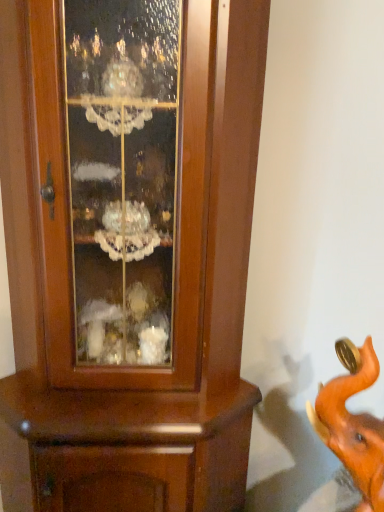
What do you see at coordinates (174, 290) in the screenshot?
I see `brown wooden cupboard at center` at bounding box center [174, 290].

Locate an element on the screen. This screenshot has width=384, height=512. brown wooden cupboard at center is located at coordinates (174, 290).

What is the approximate height of orange matte elephant at lower right?

13.83 inches.

What do you see at coordinates (353, 423) in the screenshot? This screenshot has width=384, height=512. I see `orange matte elephant at lower right` at bounding box center [353, 423].

Find the location of `orange matte elephant at lower right`. orange matte elephant at lower right is located at coordinates (353, 423).

Locate an element on the screen. Image resolution: width=384 pixels, height=512 pixels. brown wooden cupboard at center is located at coordinates (174, 290).

Is orange matte elephant at lower right at the left side of brown wooden cupboard at center?

In fact, orange matte elephant at lower right is to the right of brown wooden cupboard at center.

Is orange matte elephant at lower right further to camera compared to brown wooden cupboard at center?

No, the depth of orange matte elephant at lower right is less than that of brown wooden cupboard at center.

Does point (352, 362) lie in front of point (134, 489)?

Yes.

From the image's perspective, is orange matte elephant at lower right beneath brown wooden cupboard at center?

Yes, from the image's perspective, orange matte elephant at lower right is below brown wooden cupboard at center.

Based on the photo, from a real-world perspective, which object rests below the other?

brown wooden cupboard at center.

Does orange matte elephant at lower right have a greater width compared to brown wooden cupboard at center?

No.

Is orange matte elephant at lower right taller or shorter than brown wooden cupboard at center?

Considering their sizes, orange matte elephant at lower right has less height than brown wooden cupboard at center.

Considering the relative sizes of orange matte elephant at lower right and brown wooden cupboard at center in the image provided, is orange matte elephant at lower right bigger than brown wooden cupboard at center?

Actually, orange matte elephant at lower right might be smaller than brown wooden cupboard at center.

Would you say orange matte elephant at lower right is inside or outside brown wooden cupboard at center?

orange matte elephant at lower right is spatially situated outside brown wooden cupboard at center.

Is orange matte elephant at lower right placed right next to brown wooden cupboard at center?

There is a gap between orange matte elephant at lower right and brown wooden cupboard at center.

Is brown wooden cupboard at center at the back of orange matte elephant at lower right?

No.

How many degrees apart are the facing directions of orange matte elephant at lower right and brown wooden cupboard at center?

The facing directions of orange matte elephant at lower right and brown wooden cupboard at center are 19 degrees apart.

Measure the distance between orange matte elephant at lower right and brown wooden cupboard at center.

orange matte elephant at lower right is 20.84 inches from brown wooden cupboard at center.

You are a GUI agent. You are given a task and a screenshot of the screen. Output one action in this format:
    pyautogui.click(x=<x>, y=<y>)
    Task: Click on the elephant below the brown wooden cupboard at center (from the image's perspective)
    This screenshot has width=384, height=512.
    Given the screenshot: What is the action you would take?
    pyautogui.click(x=353, y=423)

Is brown wooden cupboard at center to the right of orange matte elephant at lower right from the viewer's perspective?

No, brown wooden cupboard at center is not to the right of orange matte elephant at lower right.

Does brown wooden cupboard at center come in front of orange matte elephant at lower right?

That is False.

Is point (37, 298) closer or farther from the camera than point (381, 430)?

Point (37, 298).

From the image's perspective, which object appears higher, brown wooden cupboard at center or orange matte elephant at lower right?

brown wooden cupboard at center is shown above in the image.

From a real-world perspective, is brown wooden cupboard at center positioned above or below orange matte elephant at lower right?

brown wooden cupboard at center is below orange matte elephant at lower right.

Considering the relative sizes of brown wooden cupboard at center and orange matte elephant at lower right in the image provided, is brown wooden cupboard at center wider than orange matte elephant at lower right?

Correct, the width of brown wooden cupboard at center exceeds that of orange matte elephant at lower right.

Can you confirm if brown wooden cupboard at center is taller than orange matte elephant at lower right?

Yes, brown wooden cupboard at center is taller than orange matte elephant at lower right.

Who is bigger, brown wooden cupboard at center or orange matte elephant at lower right?

brown wooden cupboard at center is bigger.

Is brown wooden cupboard at center positioned beyond the bounds of orange matte elephant at lower right?

Absolutely, brown wooden cupboard at center is external to orange matte elephant at lower right.

Is brown wooden cupboard at center directly adjacent to orange matte elephant at lower right?

brown wooden cupboard at center and orange matte elephant at lower right are not in contact.

Could you tell me if brown wooden cupboard at center is turned towards orange matte elephant at lower right?

No, brown wooden cupboard at center is not facing towards orange matte elephant at lower right.

Locate an element on the screen. The height and width of the screenshot is (512, 384). cupboard on the left side of orange matte elephant at lower right is located at coordinates (174, 290).

Where is `elephant on the right of the brown wooden cupboard at center`? The width and height of the screenshot is (384, 512). elephant on the right of the brown wooden cupboard at center is located at coordinates (353, 423).

I want to click on elephant in front of the brown wooden cupboard at center, so click(x=353, y=423).